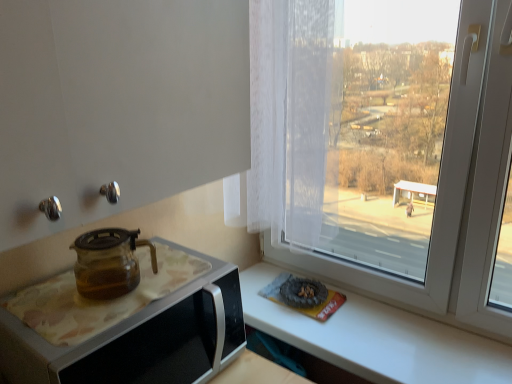
Question: From the image's perspective, relative to transparent glass teapot at left, is transparent glass teapot at left above or below?

Choices:
 (A) above
 (B) below

Answer: (B)

Question: Visually, is transparent glass teapot at left positioned to the left or to the right of transparent glass teapot at left?

Choices:
 (A) left
 (B) right

Answer: (B)

Question: In the image, is transparent glass teapot at left positioned in front of or behind transparent glass teapot at left?

Choices:
 (A) behind
 (B) front

Answer: (B)

Question: Is transparent glass teapot at left taller or shorter than transparent glass teapot at left?

Choices:
 (A) short
 (B) tall

Answer: (A)

Question: In the image, is transparent glass teapot at left on the left side or the right side of transparent glass teapot at left?

Choices:
 (A) left
 (B) right

Answer: (A)

Question: Is point (135, 261) closer or farther from the camera than point (140, 321)?

Choices:
 (A) closer
 (B) farther

Answer: (B)

Question: Considering their positions, is transparent glass teapot at left located in front of or behind transparent glass teapot at left?

Choices:
 (A) behind
 (B) front

Answer: (A)